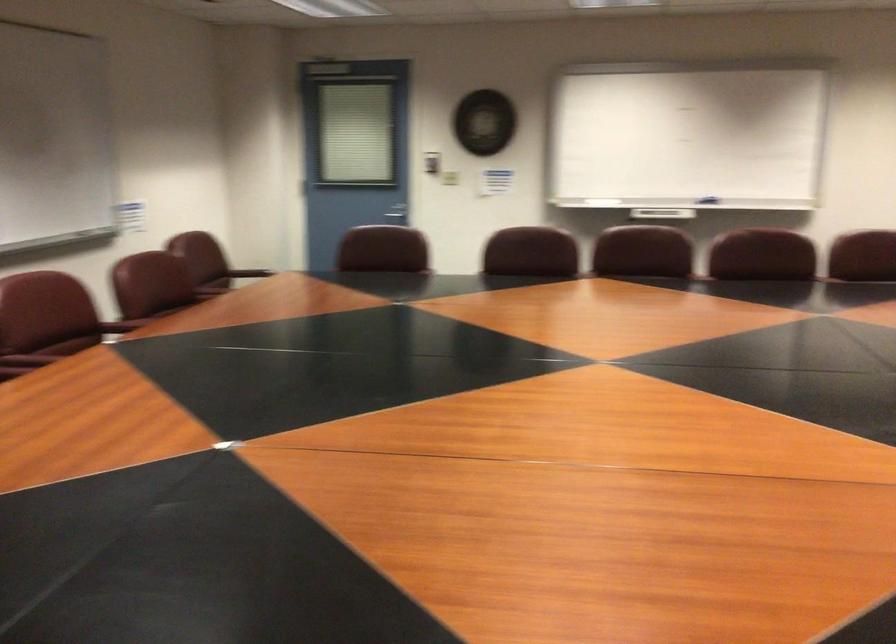
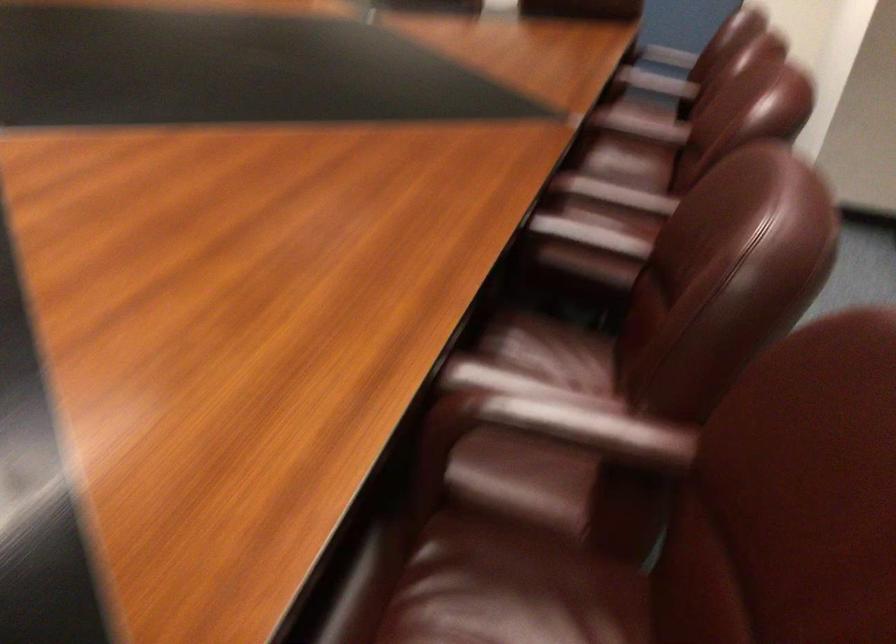
In the second image, find the point that corresponds to point 135,310 in the first image.

(613, 194)